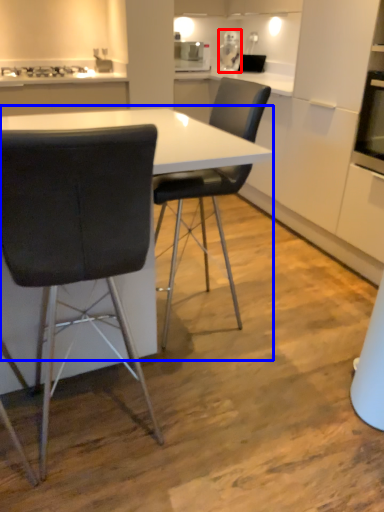
Question: Among these objects, which one is nearest to the camera, appliance (highlighted by a red box) or table (highlighted by a blue box)?

Choices:
 (A) appliance
 (B) table

Answer: (B)